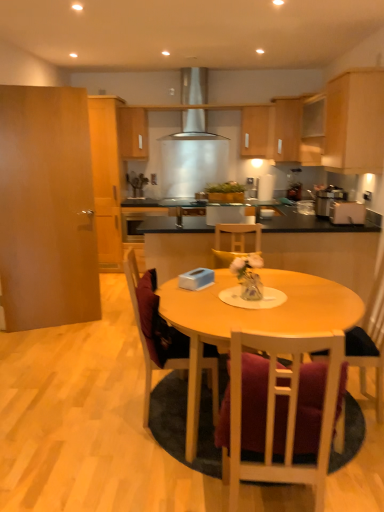
The image size is (384, 512). I want to click on free area below brown wood door at left, which is counted as the 1th cabinetry, starting from the left (from a real-world perspective), so click(x=64, y=324).